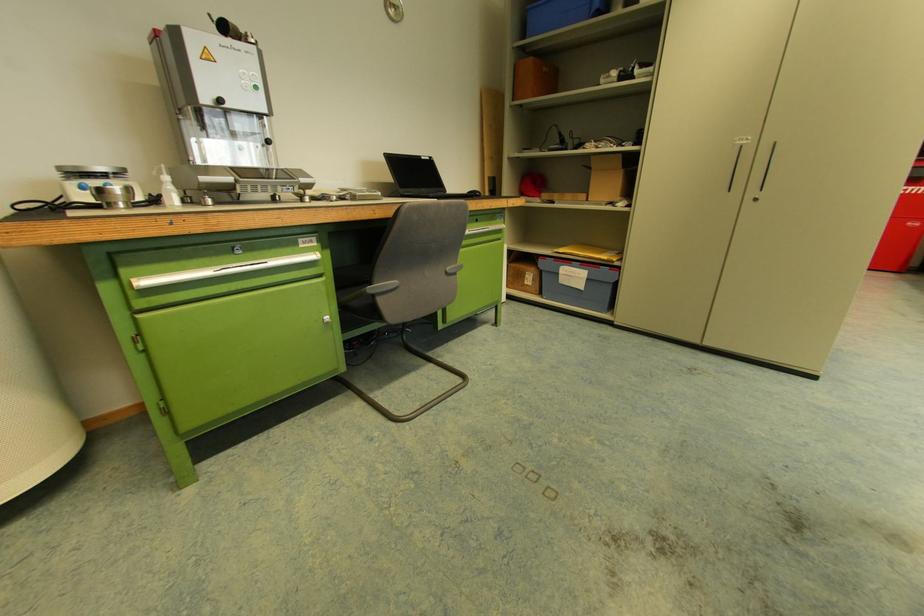
Find where to push the white round button. Please return your answer as a coordinate pair (x, y).

(325, 318)